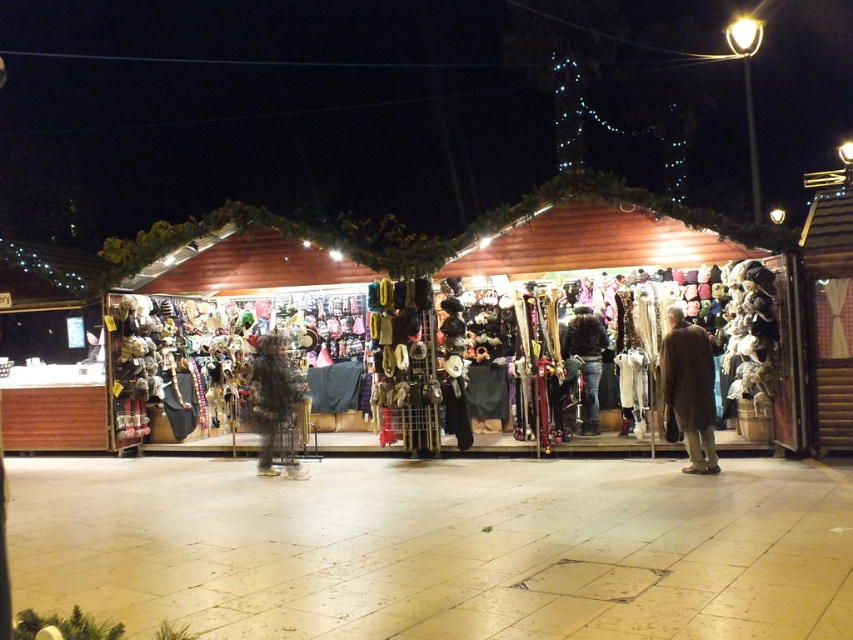
Question: Among these points, which one is nearest to the camera?

Choices:
 (A) (270, 346)
 (B) (700, 460)

Answer: (B)

Question: Does brown wool coat at right have a larger size compared to dark brown leather jacket at center?

Choices:
 (A) yes
 (B) no

Answer: (A)

Question: Which of these objects is positioned farthest from the dark brown leather jacket at center?

Choices:
 (A) brown wool coat at right
 (B) fuzzy fabric coat at center

Answer: (B)

Question: Is fuzzy fabric coat at center positioned at the back of dark brown leather jacket at center?

Choices:
 (A) no
 (B) yes

Answer: (A)

Question: Does fuzzy fabric coat at center have a greater width compared to dark brown leather jacket at center?

Choices:
 (A) no
 (B) yes

Answer: (B)

Question: Which point is closer to the camera?

Choices:
 (A) click(x=683, y=355)
 (B) click(x=595, y=368)

Answer: (A)